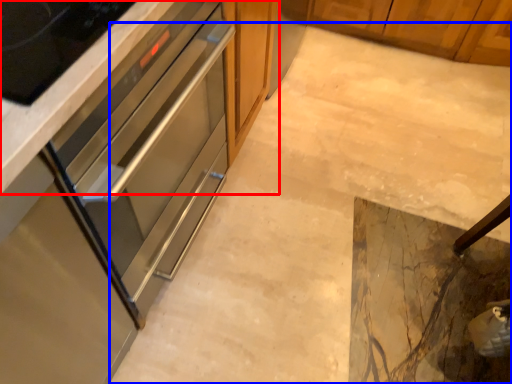
Question: Among these objects, which one is farthest to the camera, cabinetry (highlighted by a red box) or concrete (highlighted by a blue box)?

Choices:
 (A) cabinetry
 (B) concrete

Answer: (A)